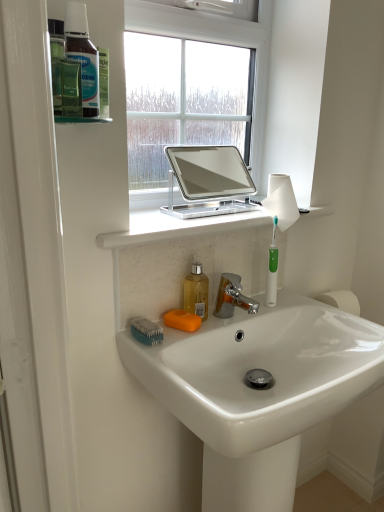
What is the approximate width of orange matte soap at sink?

orange matte soap at sink is 4.17 inches wide.

Where is `white marble countertop at upper center`? The height and width of the screenshot is (512, 384). white marble countertop at upper center is located at coordinates (204, 223).

The width and height of the screenshot is (384, 512). What do you see at coordinates (196, 292) in the screenshot? I see `translucent yellow liquid at sink` at bounding box center [196, 292].

Image resolution: width=384 pixels, height=512 pixels. What are the coordinates of `translucent plastic bottles at upper left` in the screenshot? It's located at (75, 29).

Find the location of a particular element. white glossy sink at center is located at coordinates (259, 391).

Does teal plastic brush at lower left turn towards white marble countertop at upper center?

No.

The image size is (384, 512). In order to click on brush below the white marble countertop at upper center (from the image's perspective) in this screenshot , I will do `click(146, 331)`.

Are teal plastic brush at lower left and white marble countertop at upper center beside each other?

teal plastic brush at lower left and white marble countertop at upper center are clearly separated.

Can you confirm if teal plastic brush at lower left is wider than white marble countertop at upper center?

Incorrect, the width of teal plastic brush at lower left does not surpass that of white marble countertop at upper center.

Is white glossy sink at center bigger than teal plastic brush at lower left?

Yes, white glossy sink at center is bigger than teal plastic brush at lower left.

Which object is wider, white glossy sink at center or teal plastic brush at lower left?

With larger width is white glossy sink at center.

Find the location of a particular element. The height and width of the screenshot is (512, 384). sink located on the right of teal plastic brush at lower left is located at coordinates (259, 391).

Is the depth of white glossy sink at center less than that of teal plastic brush at lower left?

Yes, it is in front of teal plastic brush at lower left.

Considering the sizes of objects translucent yellow liquid at sink and translucent plastic bottles at upper left in the image provided, who is wider, translucent yellow liquid at sink or translucent plastic bottles at upper left?

Wider between the two is translucent yellow liquid at sink.

Who is bigger, translucent yellow liquid at sink or translucent plastic bottles at upper left?

Bigger between the two is translucent yellow liquid at sink.

From a real-world perspective, is translucent yellow liquid at sink on translucent plastic bottles at upper left?

No.

Can you tell me how much translucent yellow liquid at sink and translucent plastic bottles at upper left differ in facing direction?

0.791 degrees separate the facing orientations of translucent yellow liquid at sink and translucent plastic bottles at upper left.

Is point (192, 285) in front of point (275, 303)?

Yes, it is.

Is translucent yellow liquid at sink outside of green plastic toothbrush at right?

Yes, translucent yellow liquid at sink is not within green plastic toothbrush at right.

Considering the sizes of translucent yellow liquid at sink and green plastic toothbrush at right in the image, is translucent yellow liquid at sink bigger or smaller than green plastic toothbrush at right?

translucent yellow liquid at sink is bigger than green plastic toothbrush at right.

Looking at this image, is green plastic toothbrush at right to the left of translucent yellow liquid at sink from the viewer's perspective?

Incorrect, green plastic toothbrush at right is not on the left side of translucent yellow liquid at sink.

Which of these two, green plastic toothbrush at right or translucent yellow liquid at sink, is bigger?

translucent yellow liquid at sink is bigger.

From their relative heights in the image, would you say green plastic toothbrush at right is taller or shorter than translucent yellow liquid at sink?

Clearly, green plastic toothbrush at right is taller compared to translucent yellow liquid at sink.

Is green plastic toothbrush at right far away from translucent yellow liquid at sink?

No, green plastic toothbrush at right is not far from translucent yellow liquid at sink.

Which of these two, translucent plastic bottles at upper left or teal plastic brush at lower left, is thinner?

translucent plastic bottles at upper left.

Based on the photo, visually, is translucent plastic bottles at upper left positioned to the left or to the right of teal plastic brush at lower left?

Based on their positions, translucent plastic bottles at upper left is located to the left of teal plastic brush at lower left.

In the scene shown: From the image's perspective, who appears lower, translucent plastic bottles at upper left or teal plastic brush at lower left?

teal plastic brush at lower left appears lower in the image.

Is translucent plastic bottles at upper left looking in the opposite direction of teal plastic brush at lower left?

No, translucent plastic bottles at upper left's orientation is not away from teal plastic brush at lower left.

From a real-world perspective, which object stands above the other?

green plastic toothbrush at right.

Which object is closer to the camera, green plastic toothbrush at right or teal plastic brush at lower left?

teal plastic brush at lower left is more forward.

How distant is green plastic toothbrush at right from teal plastic brush at lower left?

The distance of green plastic toothbrush at right from teal plastic brush at lower left is 14.51 inches.

From the image's perspective, is green plastic toothbrush at right positioned above or below teal plastic brush at lower left?

green plastic toothbrush at right is situated higher than teal plastic brush at lower left in the image.

Where is `counter top above the teal plastic brush at lower left (from a real-world perspective)`? counter top above the teal plastic brush at lower left (from a real-world perspective) is located at coordinates pos(204,223).

Image resolution: width=384 pixels, height=512 pixels. I want to click on sink lying in front of the teal plastic brush at lower left, so click(259, 391).

Based on their spatial positions, is translucent plastic bottles at upper left or green plastic toothbrush at right further from translucent yellow liquid at sink?

translucent plastic bottles at upper left.

Based on their spatial positions, is teal plastic brush at lower left or white marble countertop at upper center further from green plastic toothbrush at right?

teal plastic brush at lower left is positioned further to the anchor green plastic toothbrush at right.

Which object lies nearer to the anchor point translucent plastic bottles at upper left, teal plastic brush at lower left or green plastic toothbrush at right?

teal plastic brush at lower left lies closer to translucent plastic bottles at upper left than the other object.

Considering their positions, is translucent plastic bottles at upper left positioned closer to orange matte soap at sink than white marble countertop at upper center?

white marble countertop at upper center.

Estimate the real-world distances between objects in this image. Which object is closer to translucent yellow liquid at sink, green plastic toothbrush at right or orange matte soap at sink?

Among the two, orange matte soap at sink is located nearer to translucent yellow liquid at sink.

Based on their spatial positions, is translucent yellow liquid at sink or green plastic toothbrush at right closer to white glossy sink at center?

translucent yellow liquid at sink.

From the image, which object appears to be nearer to white marble countertop at upper center, green plastic toothbrush at right or translucent plastic bottles at upper left?

green plastic toothbrush at right is positioned closer to the anchor white marble countertop at upper center.

Which object lies nearer to the anchor point translucent plastic bottles at upper left, white marble countertop at upper center or green plastic toothbrush at right?

white marble countertop at upper center lies closer to translucent plastic bottles at upper left than the other object.

Identify the location of mouthwash between teal plastic brush at lower left and green plastic toothbrush at right from left to right. (196, 292).

Find the location of a particular element. This screenshot has width=384, height=512. mouthwash that lies between translucent plastic bottles at upper left and orange matte soap at sink from top to bottom is located at coordinates (196, 292).

Where is `counter top between translucent plastic bottles at upper left and white glossy sink at center vertically`? counter top between translucent plastic bottles at upper left and white glossy sink at center vertically is located at coordinates (x=204, y=223).

Where is `brush between green plastic toothbrush at right and white glossy sink at center in the vertical direction`? This screenshot has width=384, height=512. brush between green plastic toothbrush at right and white glossy sink at center in the vertical direction is located at coordinates (146, 331).